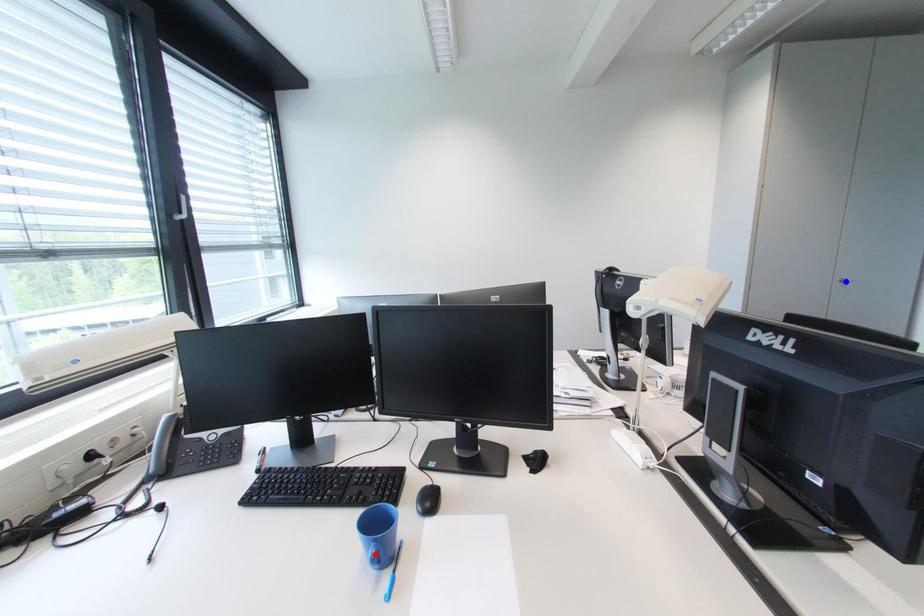
Question: In the image, two points are highlighted. Which point is nearer to the camera? Reply with the corresponding letter.

Choices:
 (A) blue point
 (B) red point

Answer: (B)